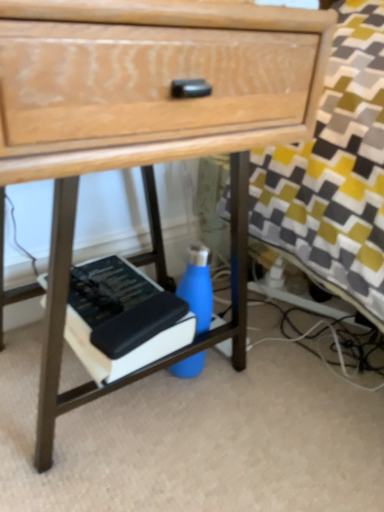
Question: From the image's perspective, is hardcover book at lower center under blue matte water bottle at center?

Choices:
 (A) yes
 (B) no

Answer: (B)

Question: Does hardcover book at lower center lie in front of blue matte water bottle at center?

Choices:
 (A) no
 (B) yes

Answer: (B)

Question: Can you confirm if hardcover book at lower center is shorter than blue matte water bottle at center?

Choices:
 (A) no
 (B) yes

Answer: (B)

Question: Is hardcover book at lower center smaller than blue matte water bottle at center?

Choices:
 (A) yes
 (B) no

Answer: (B)

Question: From a real-world perspective, does hardcover book at lower center sit lower than blue matte water bottle at center?

Choices:
 (A) no
 (B) yes

Answer: (A)

Question: Is hardcover book at lower center taller than blue matte water bottle at center?

Choices:
 (A) yes
 (B) no

Answer: (B)

Question: Considering the relative positions of blue matte water bottle at center and hardcover book at lower center in the image provided, is blue matte water bottle at center to the right of hardcover book at lower center from the viewer's perspective?

Choices:
 (A) yes
 (B) no

Answer: (A)

Question: Is blue matte water bottle at center taller than hardcover book at lower center?

Choices:
 (A) yes
 (B) no

Answer: (A)

Question: Is hardcover book at lower center at the back of blue matte water bottle at center?

Choices:
 (A) no
 (B) yes

Answer: (A)

Question: Considering the relative sizes of blue matte water bottle at center and hardcover book at lower center in the image provided, is blue matte water bottle at center shorter than hardcover book at lower center?

Choices:
 (A) yes
 (B) no

Answer: (B)

Question: Can you confirm if blue matte water bottle at center is bigger than hardcover book at lower center?

Choices:
 (A) yes
 (B) no

Answer: (B)

Question: From a real-world perspective, is blue matte water bottle at center under hardcover book at lower center?

Choices:
 (A) no
 (B) yes

Answer: (B)

Question: From a real-world perspective, is blue matte water bottle at center physically located above or below hardcover book at lower center?

Choices:
 (A) below
 (B) above

Answer: (A)